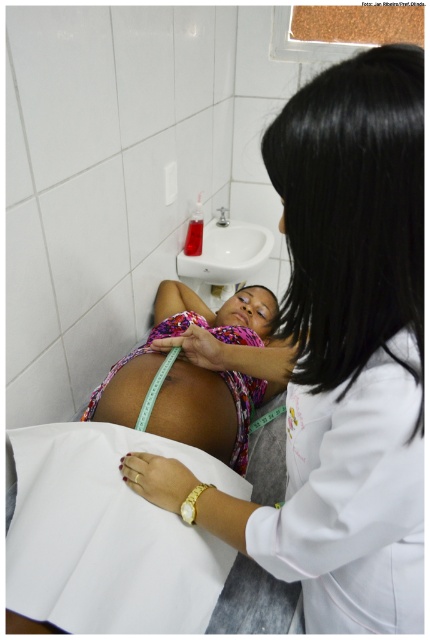
In the scene shown: You are a nurse preparing to take measurements in the examination room. You see the pink fabric at center and the multicolored fabric baby at center. Which fabric item is bigger in size?

The pink fabric at center is larger in size than the multicolored fabric baby at center.

You are a nurse entering the room and need to locate both the pink fabric at center and the white glossy sink at upper center. Which object is positioned higher up in the room?

The pink fabric at center is much taller than the white glossy sink at upper center, so the pink fabric at center is positioned higher up in the room.

You are a medical student observing a healthcare professional measuring a pregnant woman. The healthcare professional is holding a green measuring tape across the woman. The point marked at coordinates point (337,356) is part of the scene. Where is this point located?

The point (337,356) is located on the pink fabric at center.